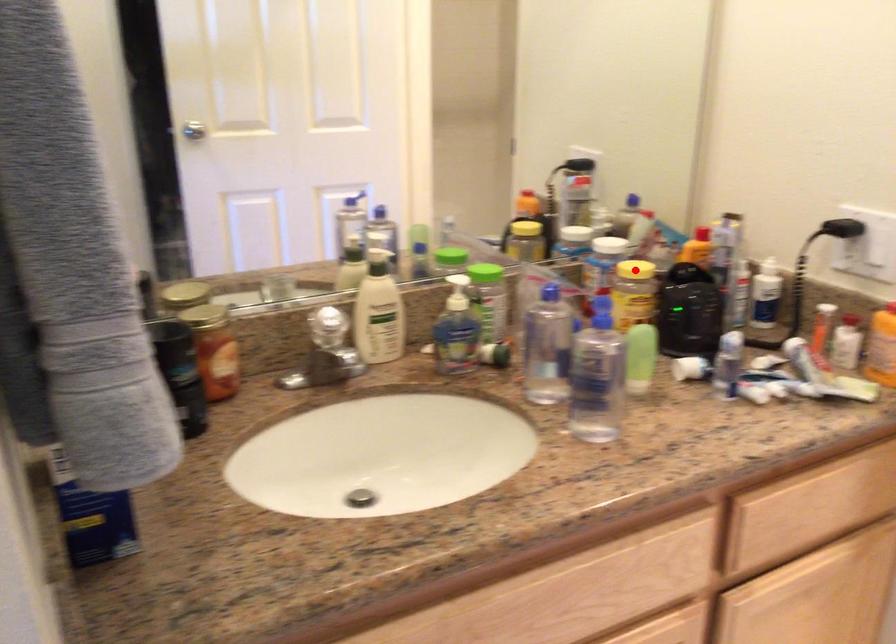
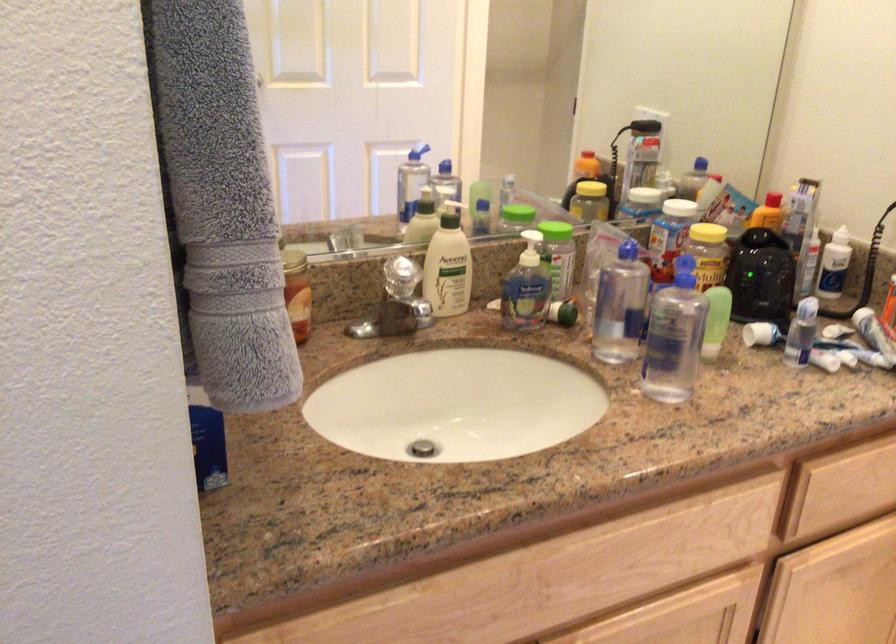
In the second image, find the point that corresponds to the highlighted location in the first image.

(707, 232)